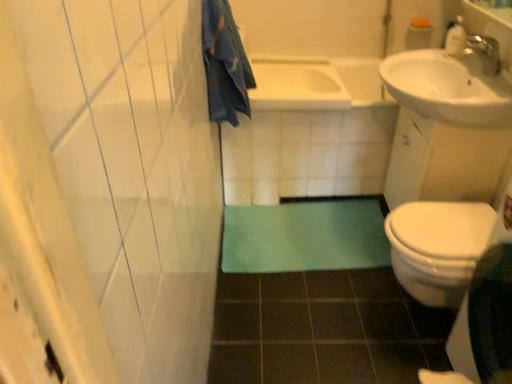
Question: Is white glossy bathtub at center, which is counted as the 1th bath, starting from the right, facing away from white plastic soap dispenser at upper right?

Choices:
 (A) no
 (B) yes

Answer: (A)

Question: Does white glossy bathtub at center, placed as the 2th bath when sorted from left to right, appear on the right side of white plastic soap dispenser at upper right?

Choices:
 (A) yes
 (B) no

Answer: (B)

Question: Does white glossy bathtub at center, placed as the 2th bath when sorted from left to right, have a greater width compared to white plastic soap dispenser at upper right?

Choices:
 (A) no
 (B) yes

Answer: (B)

Question: Is the surface of white glossy bathtub at center, placed as the 2th bath when sorted from left to right, in direct contact with white plastic soap dispenser at upper right?

Choices:
 (A) yes
 (B) no

Answer: (B)

Question: Is white glossy bathtub at center, placed as the 2th bath when sorted from left to right, positioned beyond the bounds of white plastic soap dispenser at upper right?

Choices:
 (A) yes
 (B) no

Answer: (A)

Question: Looking at the image, does blue cotton towel at upper left seem bigger or smaller compared to white plastic soap dispenser at upper right?

Choices:
 (A) small
 (B) big

Answer: (B)

Question: Considering their positions, is blue cotton towel at upper left located in front of or behind white plastic soap dispenser at upper right?

Choices:
 (A) behind
 (B) front

Answer: (B)

Question: Is blue cotton towel at upper left situated inside white plastic soap dispenser at upper right or outside?

Choices:
 (A) inside
 (B) outside

Answer: (B)

Question: From the image's perspective, is blue cotton towel at upper left located above or below white plastic soap dispenser at upper right?

Choices:
 (A) above
 (B) below

Answer: (B)

Question: Is green rubber bath mat at lower center wider or thinner than blue cotton towel at upper left?

Choices:
 (A) wide
 (B) thin

Answer: (A)

Question: Based on their sizes in the image, would you say green rubber bath mat at lower center is bigger or smaller than blue cotton towel at upper left?

Choices:
 (A) big
 (B) small

Answer: (A)

Question: Is point (284, 258) positioned closer to the camera than point (236, 119)?

Choices:
 (A) closer
 (B) farther

Answer: (B)

Question: From the image's perspective, is green rubber bath mat at lower center above or below blue cotton towel at upper left?

Choices:
 (A) above
 (B) below

Answer: (B)

Question: Considering the positions of blue cotton towel at upper left and green rubber bath mat at lower center in the image, is blue cotton towel at upper left bigger or smaller than green rubber bath mat at lower center?

Choices:
 (A) small
 (B) big

Answer: (A)

Question: From a real-world perspective, is blue cotton towel at upper left positioned above or below green rubber bath mat at lower center?

Choices:
 (A) above
 (B) below

Answer: (A)